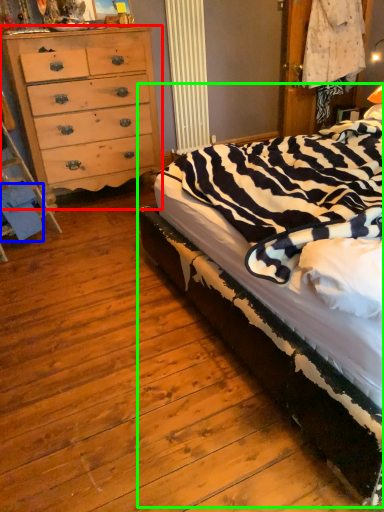
Question: Considering the real-world distances, which object is farthest from chest of drawers (highlighted by a red box)? material (highlighted by a blue box) or bed (highlighted by a green box)?

Choices:
 (A) material
 (B) bed

Answer: (B)